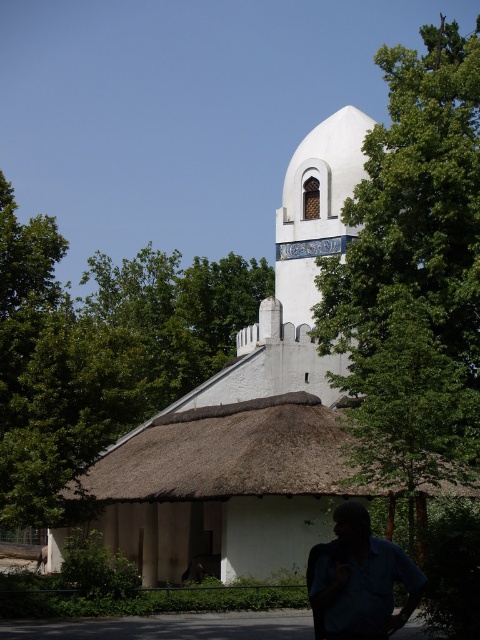
Does white stucco church at center appear under blue fabric shirt at lower right?

Actually, white stucco church at center is above blue fabric shirt at lower right.

Does white stucco church at center have a greater height compared to blue fabric shirt at lower right?

Correct, white stucco church at center is much taller as blue fabric shirt at lower right.

Which is behind, point (136, 428) or point (321, 564)?

Point (136, 428)

Find the location of `white stucco church at center`. white stucco church at center is located at coordinates (247, 410).

Which is above, white stucco church at center or green leafy tree at upper left?

Positioned higher is green leafy tree at upper left.

From the picture: Which of these two, white stucco church at center or green leafy tree at upper left, stands shorter?

Standing shorter between the two is green leafy tree at upper left.

Locate an element on the screen. This screenshot has height=640, width=480. white stucco church at center is located at coordinates pyautogui.click(x=247, y=410).

Does green leafy tree at upper left have a greater width compared to blue fabric shirt at lower right?

Yes, green leafy tree at upper left is wider than blue fabric shirt at lower right.

Who is higher up, green leafy tree at upper left or blue fabric shirt at lower right?

green leafy tree at upper left

Identify the location of green leafy tree at upper left. (98, 355).